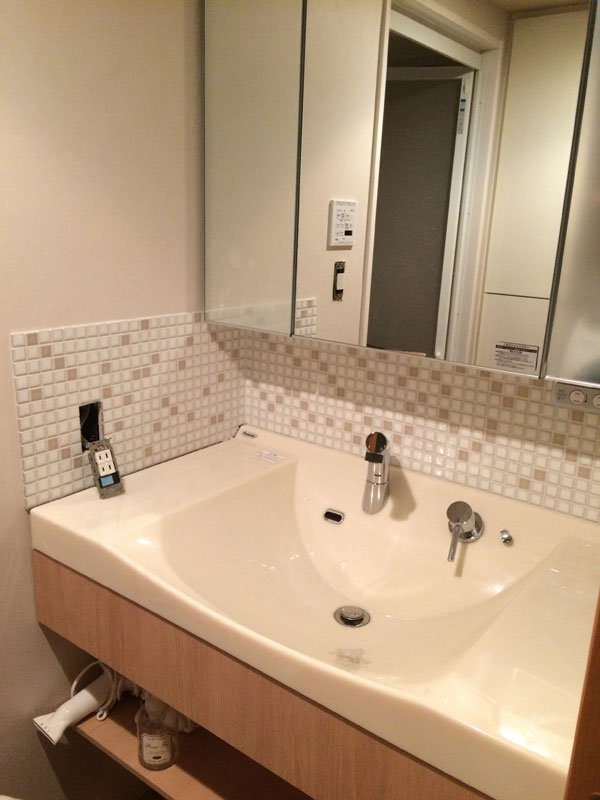
The height and width of the screenshot is (800, 600). What are the coordinates of `bottle` in the screenshot? It's located at (155, 730).